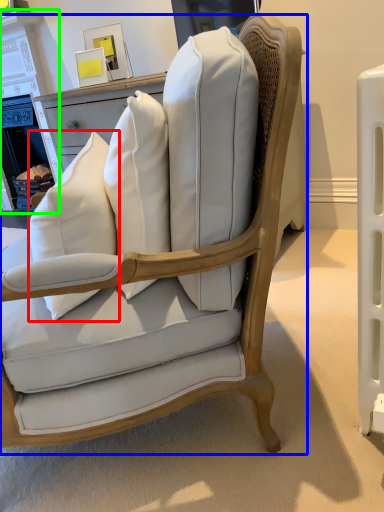
Question: Which object is the farthest from throw pillow (highlighted by a red box)? Choose among these: chair (highlighted by a blue box) or fireplace (highlighted by a green box).

Choices:
 (A) chair
 (B) fireplace

Answer: (B)